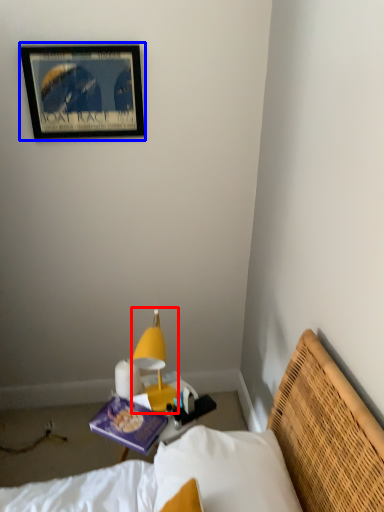
Question: Which of the following is the farthest to the observer, lamp (highlighted by a red box) or picture frame (highlighted by a blue box)?

Choices:
 (A) lamp
 (B) picture frame

Answer: (B)